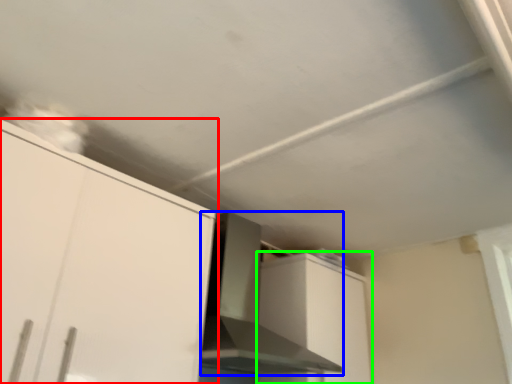
Question: Which is farther away from cabinetry (highlighted by a red box)? vent (highlighted by a blue box) or cabinetry (highlighted by a green box)?

Choices:
 (A) vent
 (B) cabinetry

Answer: (B)